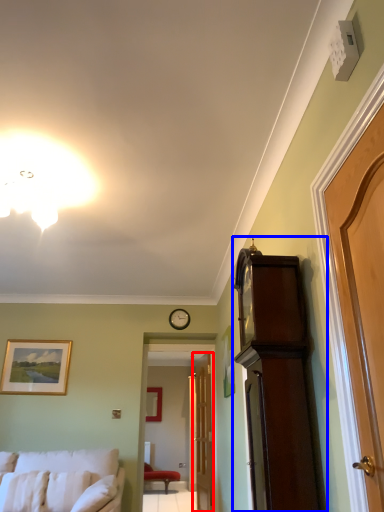
Question: Which of the following is the closest to the observer, door (highlighted by a red box) or cabinetry (highlighted by a blue box)?

Choices:
 (A) door
 (B) cabinetry

Answer: (B)